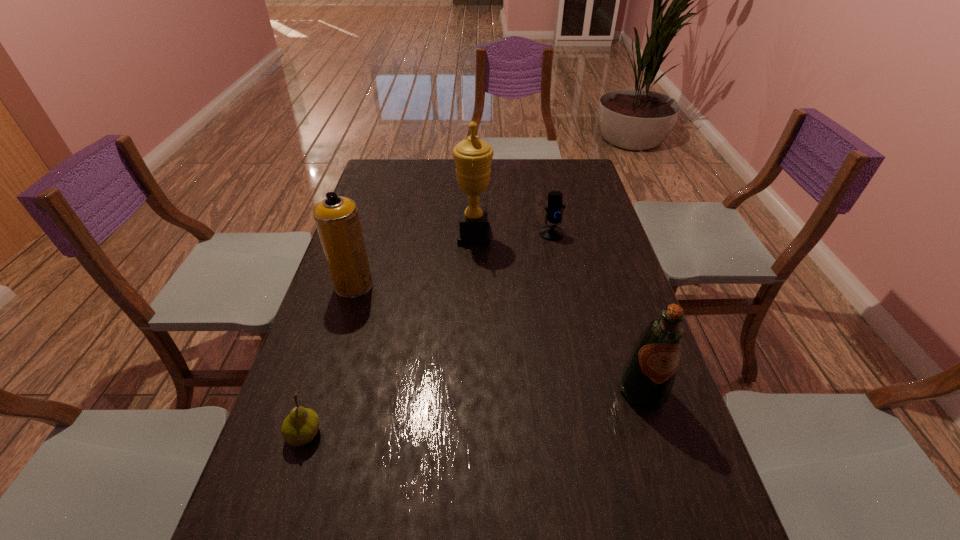
I want to click on trophy cup, so click(473, 157).

This screenshot has height=540, width=960. I want to click on the tallest object, so click(x=473, y=157).

What are the coordinates of `the third nearest object` in the screenshot? It's located at (337, 220).

Where is `the rightmost object`? This screenshot has height=540, width=960. the rightmost object is located at coordinates (647, 378).

This screenshot has height=540, width=960. I want to click on the second nearest object, so click(x=647, y=378).

Locate an element on the screen. the second object from right to left is located at coordinates (554, 212).

What are the coordinates of `the fourth tallest object` in the screenshot? It's located at (554, 212).

You are a GUI agent. You are given a task and a screenshot of the screen. Output one action in this format:
    pyautogui.click(x=<x>, y=<y>)
    Task: Click on the shortest object
    
    Given the screenshot: What is the action you would take?
    pyautogui.click(x=300, y=427)

The image size is (960, 540). Find the location of `pear`. pear is located at coordinates (300, 427).

This screenshot has height=540, width=960. I want to click on free space located at the front of the third object from right to left with handles, so click(513, 235).